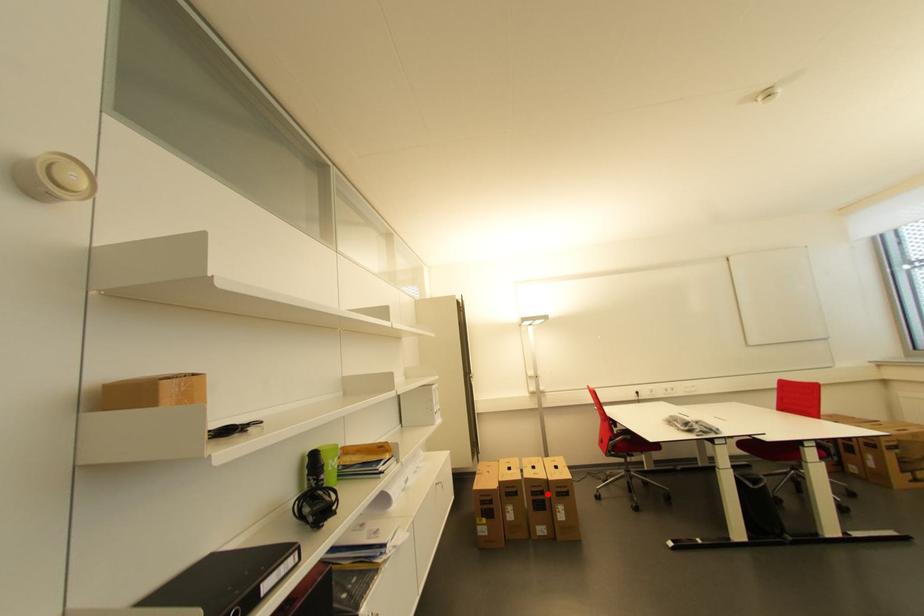
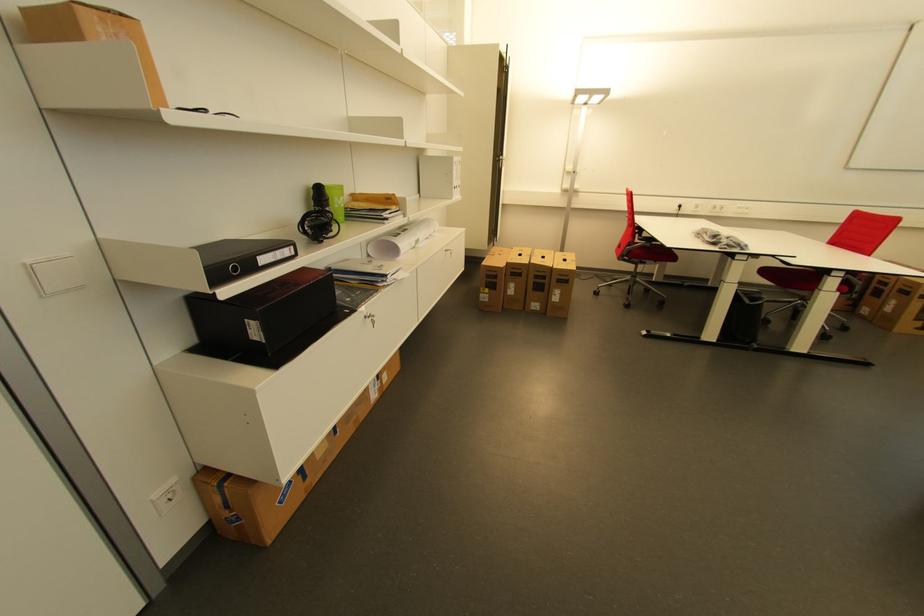
Where in the second image is the point corresponding to the highlighted location from the first image?

(550, 278)